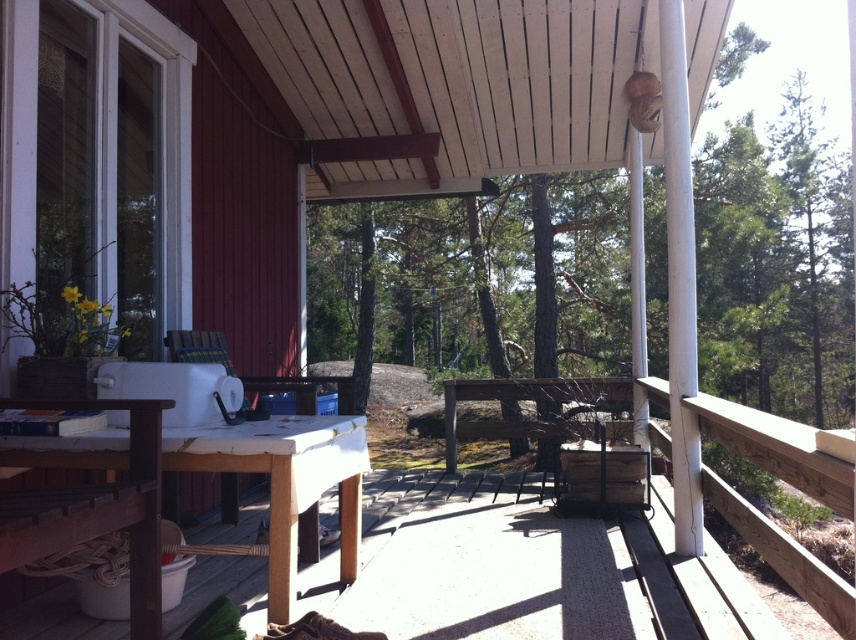
You are standing on the deck and want to place a new potted plant between the wooden table at center and the white matte table at lower left. Based on their positions, which table should the plant be closer to?

The wooden table at center is in front of the white matte table at lower left, so the plant should be placed closer to the white matte table at lower left to maintain the spatial arrangement.

You are standing in front of the wooden table at center on the deck. You want to reach into your pocket to grab your keys, which are 5 feet away from the camera. Can you safely do this without moving your body?

The wooden table at center is 4.95 feet away from the camera, so the keys are slightly farther away than the table. Since you are standing in front of the table, your keys would be just beyond your reach without moving your body.